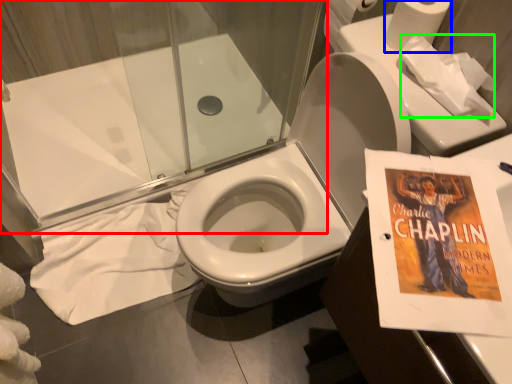
Question: Considering the real-world distances, which object is closest to shower door (highlighted by a red box)? toilet paper (highlighted by a blue box) or toilet paper (highlighted by a green box).

Choices:
 (A) toilet paper
 (B) toilet paper

Answer: (A)